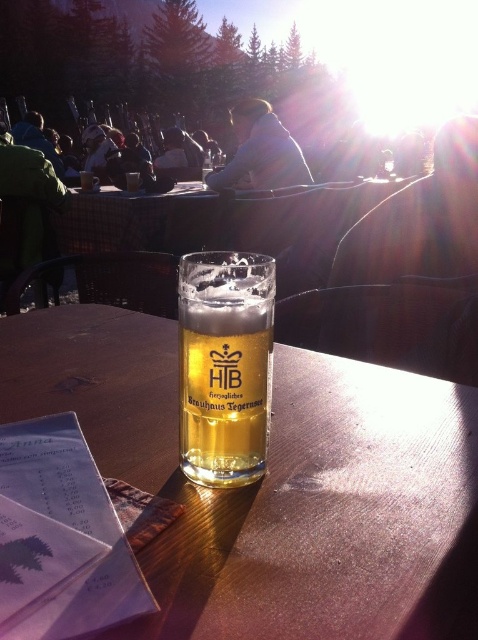
Between translucent glass at center and translucent glass beer at center, which one is positioned higher?

Positioned higher is translucent glass beer at center.

Can you confirm if translucent glass at center is bigger than translucent glass beer at center?

Yes.

The height and width of the screenshot is (640, 478). What do you see at coordinates (273, 484) in the screenshot?
I see `translucent glass at center` at bounding box center [273, 484].

This screenshot has width=478, height=640. Identify the location of translucent glass at center. (273, 484).